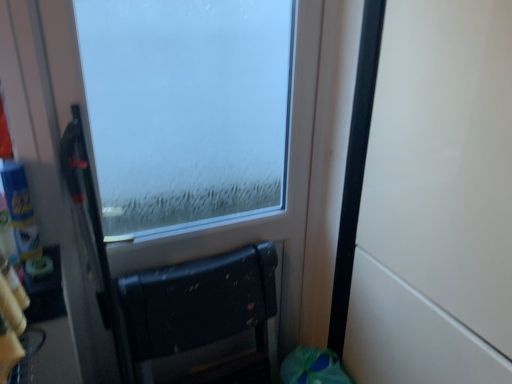
Question: Based on their positions, is black matte chair at lower center located to the left or right of frosted glass window at center?

Choices:
 (A) right
 (B) left

Answer: (B)

Question: Is black matte chair at lower center bigger or smaller than frosted glass window at center?

Choices:
 (A) small
 (B) big

Answer: (A)

Question: Which of these objects is positioned farthest from the frosted glass window at center?

Choices:
 (A) black matte chair at lower center
 (B) white matte door at right

Answer: (B)

Question: Which object is the farthest from the frosted glass window at center?

Choices:
 (A) white matte door at right
 (B) black matte chair at lower center

Answer: (A)